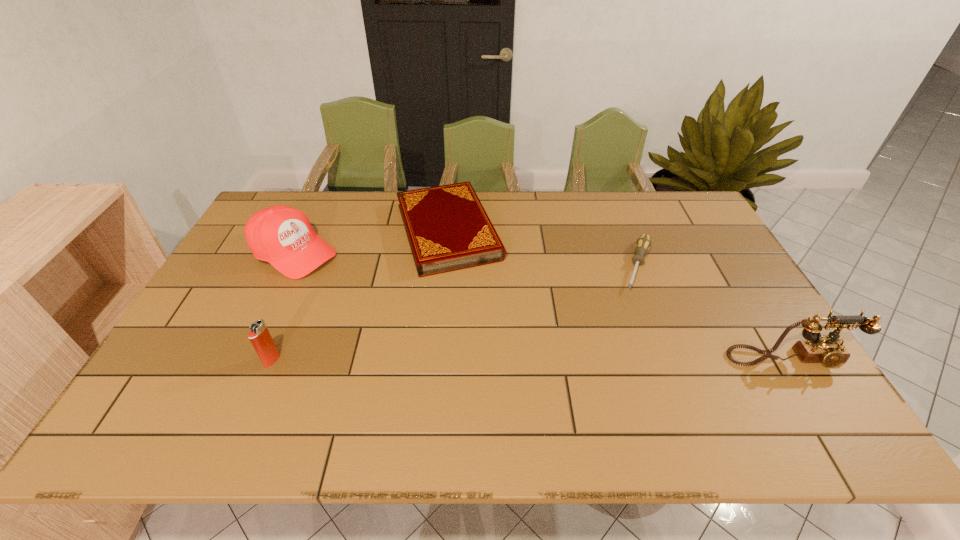
In order to click on vacant space that's between the third object from right to left and the baseball cap in this screenshot , I will do `click(371, 242)`.

The height and width of the screenshot is (540, 960). I want to click on the fourth closest object to the rightmost object, so click(x=259, y=335).

Identify which object is the second closest to the hardback book. Please provide its 2D coordinates. Your answer should be formatted as a tuple, i.e. [(x, y)], where the tuple contains the x and y coordinates of a point satisfying the conditions above.

[(643, 244)]